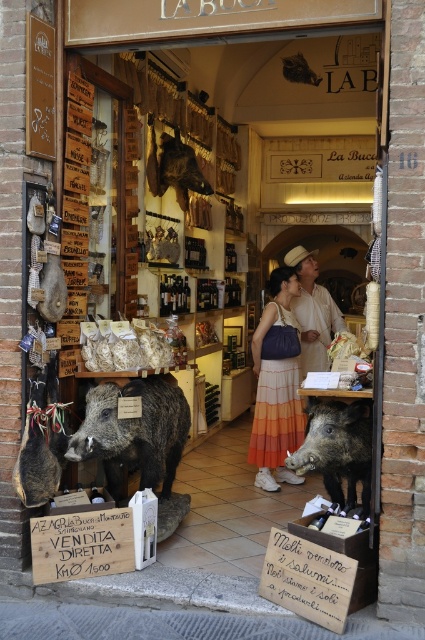
Between striped cotton dress at center and light beige straw hat at center, which one has less height?

With less height is light beige straw hat at center.

Does striped cotton dress at center come in front of light beige straw hat at center?

That is True.

Who is more forward, (269, 454) or (320, 296)?

Point (269, 454)

The image size is (425, 640). Identify the location of striped cotton dress at center. (277, 385).

Between point (306, 442) and point (295, 74), which one is positioned behind?

Positioned behind is point (295, 74).

Which is above, dark brown fur wild boar at center or shiny brown leather bag at upper center?

Positioned higher is shiny brown leather bag at upper center.

Who is more distant from viewer, (x=294, y=472) or (x=308, y=80)?

Point (x=308, y=80)

Locate an element on the screen. This screenshot has height=640, width=425. dark brown fur wild boar at center is located at coordinates (337, 449).

Consider the image. Is striped cotton dress at center wider than dark brown fur wild boar at center?

No, striped cotton dress at center is not wider than dark brown fur wild boar at center.

Between striped cotton dress at center and dark brown fur wild boar at center, which one has more height?

striped cotton dress at center is taller.

Measure the distance between point (x=266, y=340) and camera.

The distance of point (x=266, y=340) from camera is 18.24 feet.

You are a GUI agent. You are given a task and a screenshot of the screen. Output one action in this format:
    pyautogui.click(x=<x>, y=<y>)
    Task: Click on the striped cotton dress at center
    
    Given the screenshot: What is the action you would take?
    pyautogui.click(x=277, y=385)